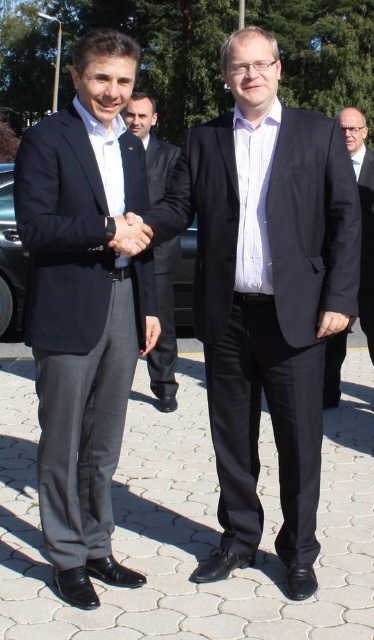
Does point (210, 576) come closer to viewer compared to point (136, 228)?

No, (210, 576) is further to viewer.

Consider the image. Who is higher up, matte black suit at center or matte black hand at center?

matte black hand at center is higher up.

Locate an element on the screen. Image resolution: width=374 pixels, height=640 pixels. matte black suit at center is located at coordinates (265, 292).

Can you confirm if black suit at center is positioned above matte black hand at center?

Incorrect, black suit at center is not positioned above matte black hand at center.

Between point (154, 253) and point (118, 244), which one is positioned in front?

Point (118, 244)

Locate an element on the screen. The width and height of the screenshot is (374, 640). black suit at center is located at coordinates (164, 326).

Is black suit at center to the left of dark gray suit at right from the viewer's perspective?

Indeed, black suit at center is positioned on the left side of dark gray suit at right.

Describe the element at coordinates (164, 326) in the screenshot. The image size is (374, 640). I see `black suit at center` at that location.

What do you see at coordinates (164, 326) in the screenshot? Image resolution: width=374 pixels, height=640 pixels. I see `black suit at center` at bounding box center [164, 326].

This screenshot has width=374, height=640. What are the coordinates of `black suit at center` in the screenshot? It's located at (164, 326).